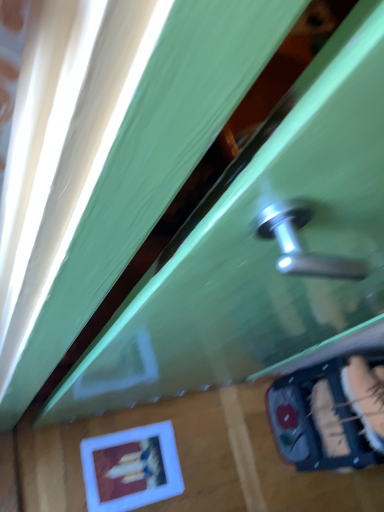
Identify the location of velvet-like fabric at lower right. Image resolution: width=384 pixels, height=512 pixels. (329, 415).

This screenshot has height=512, width=384. What do you see at coordinates (329, 415) in the screenshot?
I see `velvet-like fabric at lower right` at bounding box center [329, 415].

You are a GUI agent. You are given a task and a screenshot of the screen. Output one action in this format:
    pyautogui.click(x=<x>, y=<y>)
    Task: Click on the velvet-like fabric at lower right
    The image size is (384, 512).
    Given the screenshot: What is the action you would take?
    pyautogui.click(x=329, y=415)